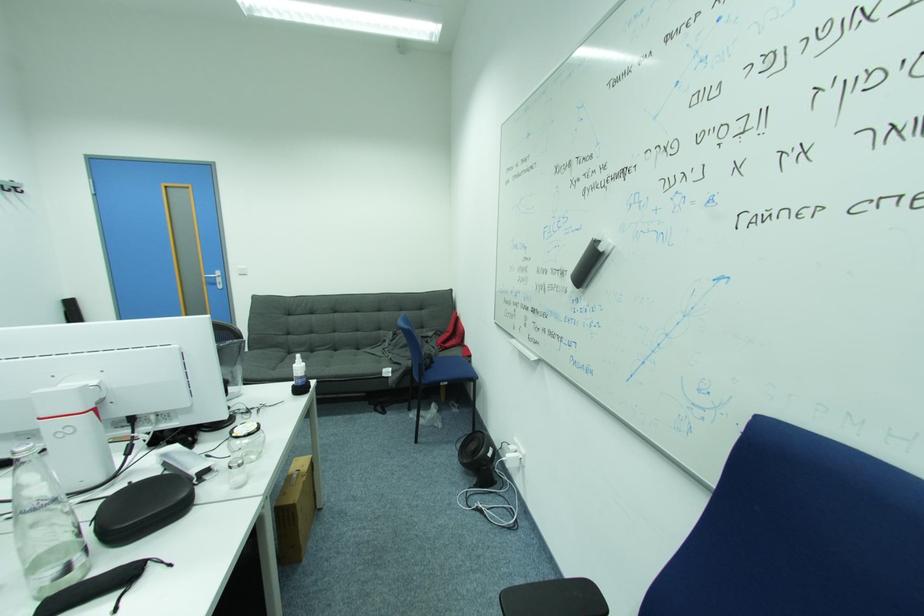
What do you see at coordinates (214, 275) in the screenshot? This screenshot has width=924, height=616. I see `the silver door handle` at bounding box center [214, 275].